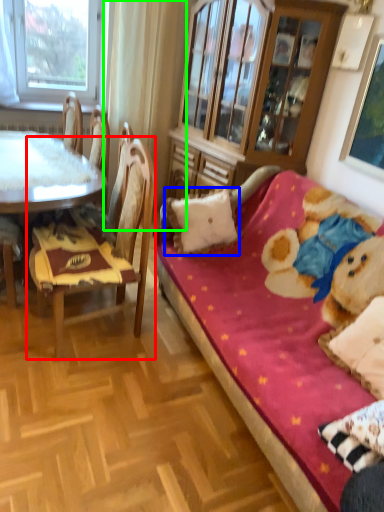
Question: Which object is the farthest from chair (highlighted by a red box)? Choose among these: pillow (highlighted by a blue box) or curtain (highlighted by a green box).

Choices:
 (A) pillow
 (B) curtain

Answer: (B)